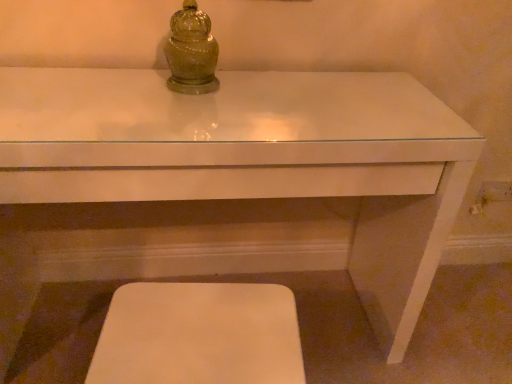
Question: Should I look upward or downward to see white matte step stool at lower center?

Choices:
 (A) up
 (B) down

Answer: (B)

Question: From a real-world perspective, is green glass jar at upper center over white matte step stool at lower center?

Choices:
 (A) yes
 (B) no

Answer: (A)

Question: Would you say green glass jar at upper center is a long distance from white matte step stool at lower center?

Choices:
 (A) yes
 (B) no

Answer: (B)

Question: Can you confirm if green glass jar at upper center is positioned to the left of white matte step stool at lower center?

Choices:
 (A) no
 (B) yes

Answer: (B)

Question: Can you confirm if green glass jar at upper center is thinner than white matte step stool at lower center?

Choices:
 (A) yes
 (B) no

Answer: (A)

Question: Can you confirm if green glass jar at upper center is shorter than white matte step stool at lower center?

Choices:
 (A) no
 (B) yes

Answer: (B)

Question: Is green glass jar at upper center oriented towards white matte step stool at lower center?

Choices:
 (A) no
 (B) yes

Answer: (A)

Question: Is white glossy table at center looking in the opposite direction of white matte step stool at lower center?

Choices:
 (A) no
 (B) yes

Answer: (B)

Question: Does white glossy table at center appear on the right side of white matte step stool at lower center?

Choices:
 (A) yes
 (B) no

Answer: (B)

Question: Does white glossy table at center have a lesser height compared to white matte step stool at lower center?

Choices:
 (A) yes
 (B) no

Answer: (B)

Question: Considering the relative positions of white glossy table at center and white matte step stool at lower center in the image provided, is white glossy table at center to the left of white matte step stool at lower center from the viewer's perspective?

Choices:
 (A) no
 (B) yes

Answer: (B)

Question: From the image's perspective, is white glossy table at center located above white matte step stool at lower center?

Choices:
 (A) no
 (B) yes

Answer: (B)

Question: From the image's perspective, is white glossy table at center located beneath white matte step stool at lower center?

Choices:
 (A) yes
 (B) no

Answer: (B)

Question: Is white matte step stool at lower center facing towards white glossy table at center?

Choices:
 (A) yes
 (B) no

Answer: (B)